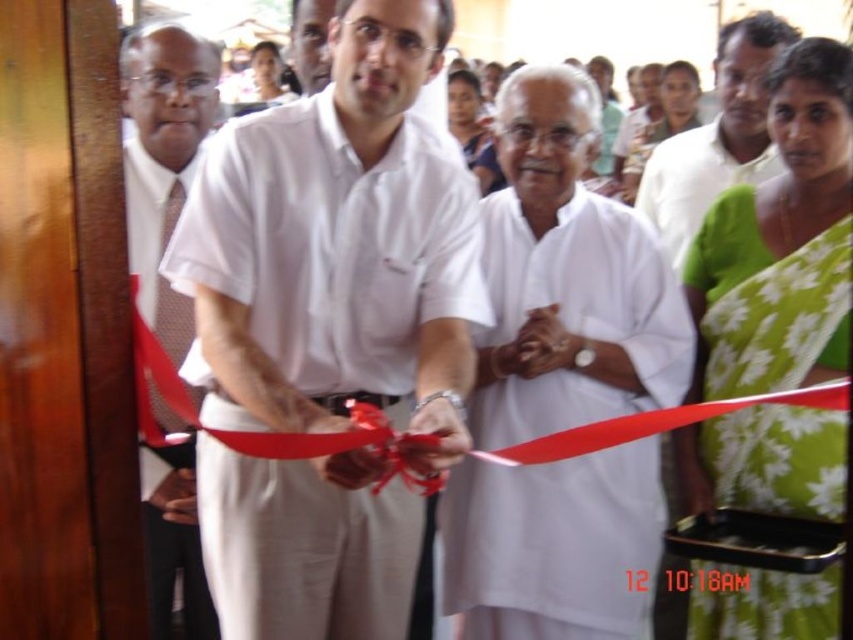
You are observing a ceremonial event where two men are present. You notice the white smooth shirt at center and the white cotton shirt at center. Which one is positioned lower in the image?

The white smooth shirt at center is positioned lower than the white cotton shirt at center.

Based on the photo, you are a photographer at the inauguration event. You need to capture a closeup shot of the white cotton shirt at center and the smooth skin face at upper center in one frame. Based on their sizes, which object should you focus on first to ensure both are in focus?

The white cotton shirt at center has a smaller size compared to smooth skin face at upper center. To ensure both are in focus, you should focus on the larger object first, which is the smooth skin face at upper center, as it requires more precise focusing due to its size.